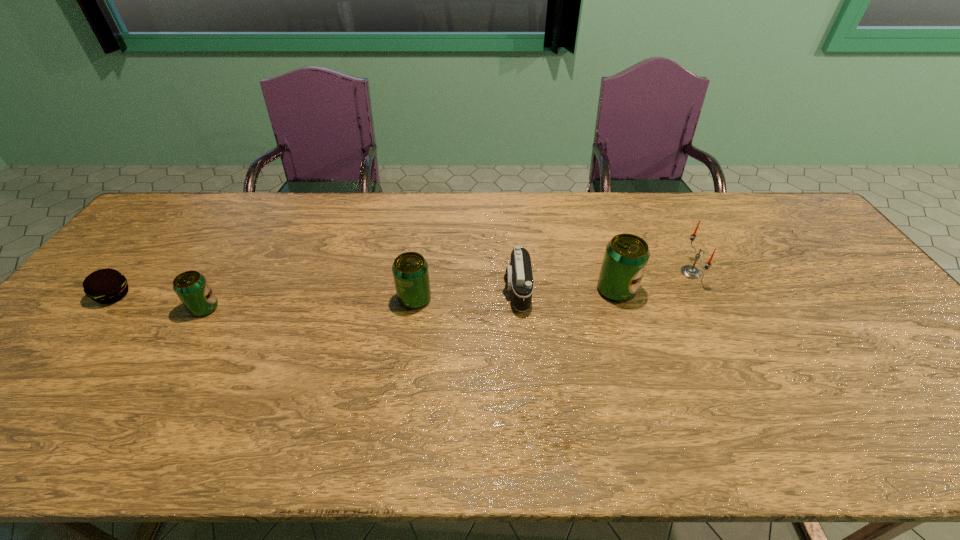
Image resolution: width=960 pixels, height=540 pixels. I want to click on object at the left edge, so tap(105, 286).

In the image, there is a desktop. Where is `vacant area at the far edge`? The width and height of the screenshot is (960, 540). vacant area at the far edge is located at coordinates (449, 219).

Where is `vacant space at the near edge of the desktop`? This screenshot has height=540, width=960. vacant space at the near edge of the desktop is located at coordinates (86, 394).

In the image, there is a desktop. At what (x,y) coordinates should I click in order to perform the action: click on vacant space at the left edge. Please return your answer as a coordinate pair (x, y). This screenshot has width=960, height=540. Looking at the image, I should click on (108, 318).

Where is `blank space at the far left corner of the desktop`? This screenshot has height=540, width=960. blank space at the far left corner of the desktop is located at coordinates [145, 230].

This screenshot has width=960, height=540. I want to click on vacant area at the far right corner, so click(x=780, y=229).

Locate an element on the screen. unoccupied position between the shortest beer can and the leftmost object is located at coordinates (159, 302).

At what (x,y) coordinates should I click in order to perform the action: click on free point between the leftmost beer can and the camera. Please return your answer as a coordinate pair (x, y). The width and height of the screenshot is (960, 540). Looking at the image, I should click on (361, 299).

The height and width of the screenshot is (540, 960). In order to click on vacant space that is in between the second tallest beer can and the leftmost object in this screenshot , I will do `click(264, 297)`.

Identify the location of vacant region between the second object from left to right and the leftmost object. (159, 302).